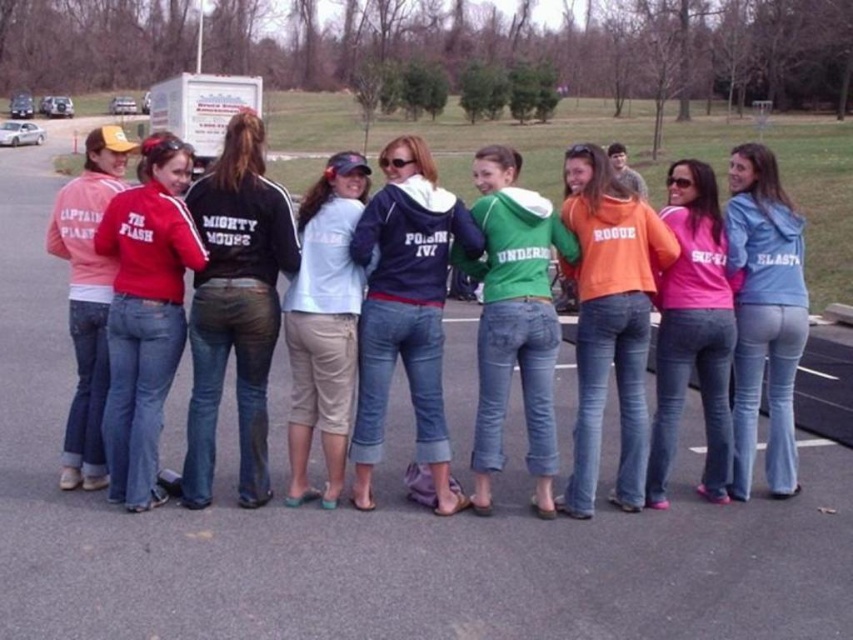
Question: Which object is closer to the camera taking this photo?

Choices:
 (A) orange fleece jacket at center
 (B) blue denim jeans at right

Answer: (A)

Question: Which is nearer to the navy blue hoodie at center?

Choices:
 (A) matte orange sweatshirt at left
 (B) green matte hoodie at center
 (C) pink matte shirt at center
 (D) light blue denim shorts at center

Answer: (D)

Question: Is navy blue hoodie at center smaller than blue denim jeans at right?

Choices:
 (A) yes
 (B) no

Answer: (A)

Question: Can you confirm if matte red jacket at center is positioned below blue denim jeans at right?

Choices:
 (A) yes
 (B) no

Answer: (B)

Question: Among these objects, which one is farthest from the camera?

Choices:
 (A) matte orange sweatshirt at left
 (B) matte red jacket at center

Answer: (A)

Question: Where is navy blue hoodie at center located in relation to orange fleece jacket at center in the image?

Choices:
 (A) left
 (B) right

Answer: (A)